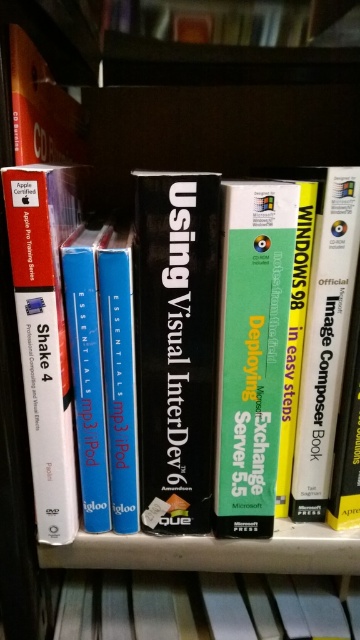
You are organizing a library and need to ensure that all books are properly aligned on the shelf. You notice the green matte book at center and the black matte book at center. Which book should you adjust to make sure they are aligned correctly?

The green matte book at center is in front of the black matte book at center, so you should move the green matte book at center back to align it with the black matte book at center.

You are standing 16 inches away from the bookshelf. You want to grab the green matte book at center without moving your position. Is it within your reach?

The green matte book at center is 15.86 inches away from viewer, so yes, it is within reach since you are standing 16 inches away from the bookshelf.

You are organizing a bookshelf and need to place a new book between the leftmost book and the second book from the left. The new book is the green matte book at center. According to the bookshelf layout, can you place it there?

The green matte book at center is located at point (251, 352), which is between the leftmost book and the second book from the left. Therefore, you can place it there.